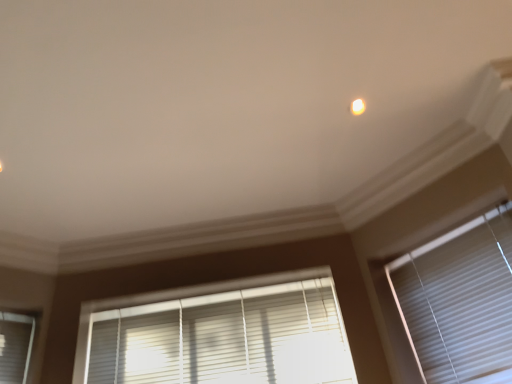
The height and width of the screenshot is (384, 512). Describe the element at coordinates (221, 334) in the screenshot. I see `white plastic blinds at lower center, the 1th window blind positioned from the left` at that location.

Locate an element on the screen. The image size is (512, 384). white glossy light at upper center is located at coordinates (357, 107).

Find the location of a particular element. This screenshot has height=384, width=512. white plastic blinds at lower center, the 1th window blind positioned from the left is located at coordinates (221, 334).

Which object is positioned more to the right, white glossy light at upper center or white matte window blind at right, acting as the second window blind starting from the left?

From the viewer's perspective, white matte window blind at right, acting as the second window blind starting from the left, appears more on the right side.

Is white glossy light at upper center bigger or smaller than white matte window blind at right, acting as the second window blind starting from the left?

In the image, white glossy light at upper center appears to be smaller than white matte window blind at right, acting as the second window blind starting from the left.

Is white glossy light at upper center thinner than white matte window blind at right, acting as the second window blind starting from the left?

No, white glossy light at upper center is not thinner than white matte window blind at right, acting as the second window blind starting from the left.

From the image's perspective, is white glossy light at upper center on white matte window blind at right, which appears as the 1th window blind when viewed from the right?

Yes, from the image's perspective, white glossy light at upper center is above white matte window blind at right, which appears as the 1th window blind when viewed from the right.

Locate an element on the screen. window blind located above the white matte window blind at right, which appears as the 1th window blind when viewed from the right (from a real-world perspective) is located at coordinates (221, 334).

Could you tell me if white plastic blinds at lower center, which appears as the second window blind when viewed from the right, is facing white matte window blind at right, acting as the second window blind starting from the left?

No, white plastic blinds at lower center, which appears as the second window blind when viewed from the right, is not oriented towards white matte window blind at right, acting as the second window blind starting from the left.

Can you confirm if white plastic blinds at lower center, which appears as the second window blind when viewed from the right, is thinner than white matte window blind at right, acting as the second window blind starting from the left?

In fact, white plastic blinds at lower center, which appears as the second window blind when viewed from the right, might be wider than white matte window blind at right, acting as the second window blind starting from the left.

Is the surface of white plastic blinds at lower center, the 1th window blind positioned from the left, in direct contact with white matte window blind at right, which appears as the 1th window blind when viewed from the right?

No, white plastic blinds at lower center, the 1th window blind positioned from the left, is not in contact with white matte window blind at right, which appears as the 1th window blind when viewed from the right.

Which is in front, point (437, 319) or point (183, 358)?

Positioned in front is point (437, 319).

From a real-world perspective, who is located lower, white matte window blind at right, acting as the second window blind starting from the left, or white plastic blinds at lower center, which appears as the second window blind when viewed from the right?

In real-world perspective, white matte window blind at right, acting as the second window blind starting from the left, is lower.

Considering the sizes of white matte window blind at right, which appears as the 1th window blind when viewed from the right, and white plastic blinds at lower center, which appears as the second window blind when viewed from the right, in the image, is white matte window blind at right, which appears as the 1th window blind when viewed from the right, taller or shorter than white plastic blinds at lower center, which appears as the second window blind when viewed from the right,?

white matte window blind at right, which appears as the 1th window blind when viewed from the right, is taller than white plastic blinds at lower center, which appears as the second window blind when viewed from the right.

Considering the positions of objects white matte window blind at right, which appears as the 1th window blind when viewed from the right, and white plastic blinds at lower center, the 1th window blind positioned from the left, in the image provided, who is behind, white matte window blind at right, which appears as the 1th window blind when viewed from the right, or white plastic blinds at lower center, the 1th window blind positioned from the left,?

white plastic blinds at lower center, the 1th window blind positioned from the left, is more distant.

Which is more to the right, white matte window blind at right, acting as the second window blind starting from the left, or white glossy light at upper center?

Positioned to the right is white matte window blind at right, acting as the second window blind starting from the left.

Is point (418, 344) closer to viewer compared to point (350, 109)?

That is False.

Considering the sizes of objects white matte window blind at right, acting as the second window blind starting from the left, and white glossy light at upper center in the image provided, who is taller, white matte window blind at right, acting as the second window blind starting from the left, or white glossy light at upper center?

With more height is white matte window blind at right, acting as the second window blind starting from the left.

Find the location of a particular element. light above the white matte window blind at right, acting as the second window blind starting from the left (from the image's perspective) is located at coordinates (357, 107).

Considering the positions of objects white glossy light at upper center and white plastic blinds at lower center, the 1th window blind positioned from the left, in the image provided, who is behind, white glossy light at upper center or white plastic blinds at lower center, the 1th window blind positioned from the left,?

white plastic blinds at lower center, the 1th window blind positioned from the left, is behind.

Can you tell me how much white glossy light at upper center and white plastic blinds at lower center, the 1th window blind positioned from the left, differ in facing direction?

white glossy light at upper center and white plastic blinds at lower center, the 1th window blind positioned from the left, are facing 1.64 degrees away from each other.

Does white glossy light at upper center turn towards white plastic blinds at lower center, the 1th window blind positioned from the left?

No, white glossy light at upper center is not turned towards white plastic blinds at lower center, the 1th window blind positioned from the left.

From a real-world perspective, is white plastic blinds at lower center, the 1th window blind positioned from the left, located beneath white glossy light at upper center?

Correct, in the physical world, white plastic blinds at lower center, the 1th window blind positioned from the left, is lower than white glossy light at upper center.

Is white plastic blinds at lower center, the 1th window blind positioned from the left, wider or thinner than white glossy light at upper center?

Considering their sizes, white plastic blinds at lower center, the 1th window blind positioned from the left, looks slimmer than white glossy light at upper center.

Is white plastic blinds at lower center, which appears as the second window blind when viewed from the right, located outside white glossy light at upper center?

Yes.

What are the coordinates of `window blind on the right of white glossy light at upper center` in the screenshot? It's located at (460, 301).

What are the coordinates of `window blind beneath the white plastic blinds at lower center, the 1th window blind positioned from the left (from a real-world perspective)` in the screenshot? It's located at (460, 301).

Considering their positions, is white glossy light at upper center positioned closer to white plastic blinds at lower center, the 1th window blind positioned from the left, than white matte window blind at right, which appears as the 1th window blind when viewed from the right?

Among the two, white matte window blind at right, which appears as the 1th window blind when viewed from the right, is located nearer to white plastic blinds at lower center, the 1th window blind positioned from the left.

From the image, which object appears to be farther from white matte window blind at right, which appears as the 1th window blind when viewed from the right, white glossy light at upper center or white plastic blinds at lower center, which appears as the second window blind when viewed from the right?

white glossy light at upper center.

Looking at the image, which one is located further to white glossy light at upper center, white plastic blinds at lower center, which appears as the second window blind when viewed from the right, or white matte window blind at right, acting as the second window blind starting from the left?

white plastic blinds at lower center, which appears as the second window blind when viewed from the right, is further to white glossy light at upper center.

Which object lies nearer to the anchor point white plastic blinds at lower center, which appears as the second window blind when viewed from the right, white matte window blind at right, which appears as the 1th window blind when viewed from the right, or white glossy light at upper center?

white matte window blind at right, which appears as the 1th window blind when viewed from the right, is closer to white plastic blinds at lower center, which appears as the second window blind when viewed from the right.

Which object lies nearer to the anchor point white matte window blind at right, acting as the second window blind starting from the left, white plastic blinds at lower center, the 1th window blind positioned from the left, or white glossy light at upper center?

white plastic blinds at lower center, the 1th window blind positioned from the left, lies closer to white matte window blind at right, acting as the second window blind starting from the left, than the other object.

Based on their spatial positions, is white matte window blind at right, which appears as the 1th window blind when viewed from the right, or white plastic blinds at lower center, which appears as the second window blind when viewed from the right, further from white glossy light at upper center?

white plastic blinds at lower center, which appears as the second window blind when viewed from the right, is further to white glossy light at upper center.

The width and height of the screenshot is (512, 384). Identify the location of window blind between white glossy light at upper center and white plastic blinds at lower center, the 1th window blind positioned from the left, vertically. (460, 301).